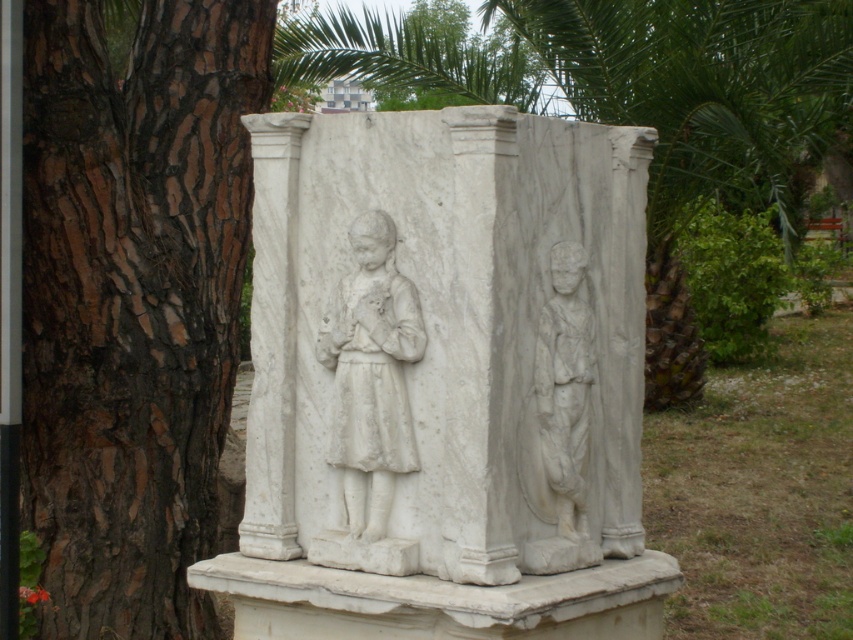
Is point (79, 96) farther from camera compared to point (548, 300)?

Yes, point (79, 96) is farther from viewer.

Can you confirm if brown rough bark tree at left is thinner than white marble statue at right?

No.

Which is behind, point (39, 340) or point (583, 502)?

Positioned behind is point (39, 340).

Image resolution: width=853 pixels, height=640 pixels. What are the coordinates of `brown rough bark tree at left` in the screenshot? It's located at (132, 300).

Does brown rough bark tree at left have a greater width compared to white marble statue at center?

Correct, the width of brown rough bark tree at left exceeds that of white marble statue at center.

Is brown rough bark tree at left below white marble statue at center?

No.

Identify the location of brown rough bark tree at left. The height and width of the screenshot is (640, 853). (132, 300).

The image size is (853, 640). I want to click on brown rough bark tree at left, so click(x=132, y=300).

Does white marble statue at center have a greater height compared to white marble statue at right?

Indeed, white marble statue at center has a greater height compared to white marble statue at right.

Is white marble statue at center shorter than white marble statue at right?

In fact, white marble statue at center may be taller than white marble statue at right.

You are a GUI agent. You are given a task and a screenshot of the screen. Output one action in this format:
    pyautogui.click(x=<x>, y=<y>)
    Task: Click on the white marble statue at center
    
    Given the screenshot: What is the action you would take?
    pyautogui.click(x=370, y=374)